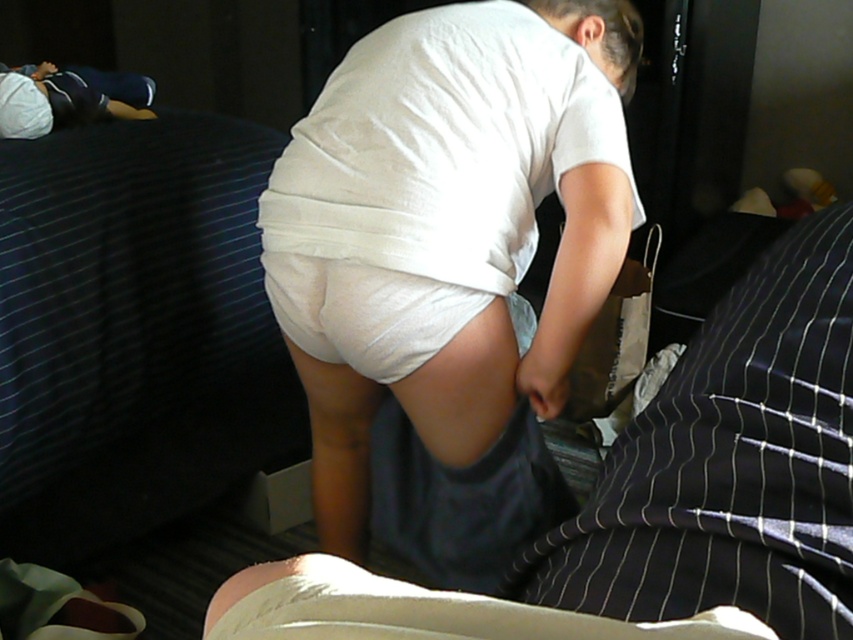
Consider the image. You are a delivery robot with a package that needs to be placed between the white matte shorts at center and the white cotton shirt at upper left. The package is 90 centimeters long. Can you fit it between them?

The distance between the white matte shorts at center and the white cotton shirt at upper left is 87.72 centimeters. Since the package is 90 centimeters long, it cannot fit between them as it is longer than the available space.

You are a delivery robot trying to navigate to the white cotton shirt at upper left. The dark blue striped bed at left is in your way. Can you move around it if your minimum turning radius is 40 centimeters?

The distance between dark blue striped bed at left and white cotton shirt at upper left is 35.68 centimeters, which is less than your minimum turning radius of 40 centimeters. Therefore, you cannot move around the dark blue striped bed at left to reach the white cotton shirt at upper left.